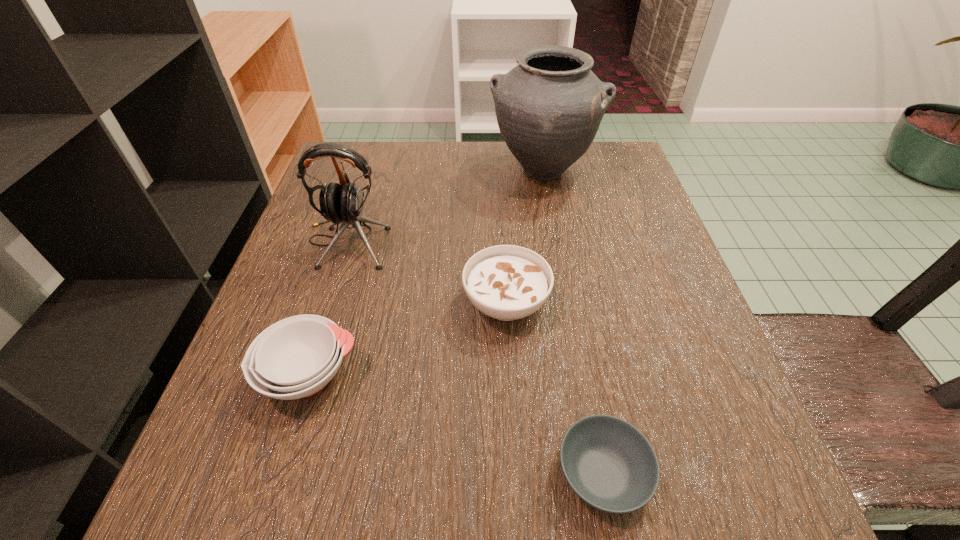
Where is `vacant space at the left edge of the desktop`? vacant space at the left edge of the desktop is located at coordinates (312, 264).

I want to click on free region at the right edge of the desktop, so click(632, 214).

The image size is (960, 540). Find the location of `free space at the far left corner`. free space at the far left corner is located at coordinates (351, 180).

This screenshot has height=540, width=960. Identify the location of vacant space at the near left corner. (271, 504).

Locate an element on the screen. The width and height of the screenshot is (960, 540). free space at the near right corner of the desktop is located at coordinates (748, 504).

In order to click on vacant region between the shortest soup bowl and the farthest object in this screenshot , I will do `click(572, 322)`.

This screenshot has width=960, height=540. I want to click on vacant point located between the leftmost soup bowl and the urn, so click(426, 273).

At what (x,y) coordinates should I click in order to perform the action: click on vacant point located between the nearest soup bowl and the second farthest object. Please return your answer as a coordinate pair (x, y). Looking at the image, I should click on (474, 358).

Where is `free spot between the nearest soup bowl and the fourth shortest object`? This screenshot has height=540, width=960. free spot between the nearest soup bowl and the fourth shortest object is located at coordinates (474, 358).

You are a GUI agent. You are given a task and a screenshot of the screen. Output one action in this format:
    pyautogui.click(x=<x>, y=<y>)
    Task: Click on the unoccupied area between the farthest object and the fourth shortest object
    Image resolution: width=960 pixels, height=540 pixels.
    Given the screenshot: What is the action you would take?
    pyautogui.click(x=445, y=206)